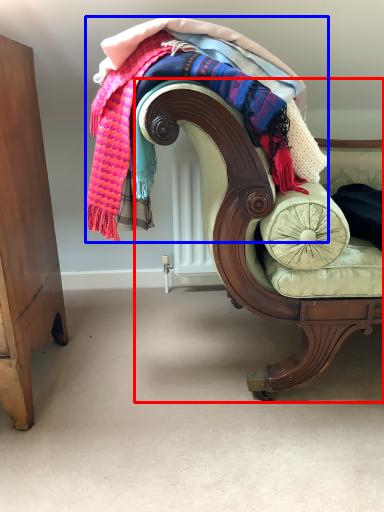
Question: Which object is further to the camera taking this photo, chair (highlighted by a red box) or laundry (highlighted by a blue box)?

Choices:
 (A) chair
 (B) laundry

Answer: (B)